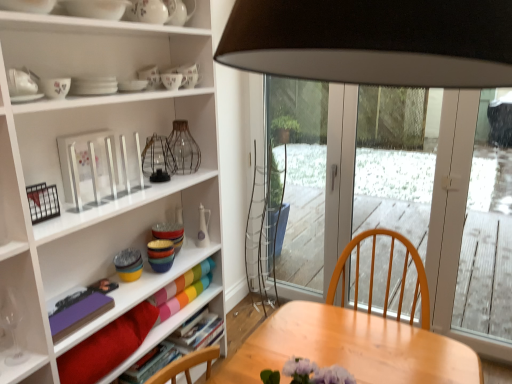
Question: Is white ceramic bowl at upper left, marked as the third tableware in a top-to-bottom arrangement, to the left of transparent glass wine glass at lower left from the viewer's perspective?

Choices:
 (A) yes
 (B) no

Answer: (B)

Question: Is white ceramic bowl at upper left, which is the 10th tableware from bottom to top, located outside transparent glass wine glass at lower left?

Choices:
 (A) yes
 (B) no

Answer: (A)

Question: Is white ceramic bowl at upper left, marked as the third tableware in a top-to-bottom arrangement, smaller than transparent glass wine glass at lower left?

Choices:
 (A) yes
 (B) no

Answer: (B)

Question: Does white ceramic bowl at upper left, which is the 10th tableware from bottom to top, have a larger size compared to transparent glass wine glass at lower left?

Choices:
 (A) no
 (B) yes

Answer: (B)

Question: Is white ceramic bowl at upper left, which is the 10th tableware from bottom to top, turned away from transparent glass wine glass at lower left?

Choices:
 (A) no
 (B) yes

Answer: (A)

Question: From the image's perspective, does white ceramic bowl at upper left, marked as the third tableware in a top-to-bottom arrangement, appear higher than transparent glass wine glass at lower left?

Choices:
 (A) yes
 (B) no

Answer: (A)

Question: Considering the relative sizes of white ceramic vase at center, placed as the third tableware when sorted from bottom to top, and purple matte book at lower left, acting as the first book starting from the front, in the image provided, is white ceramic vase at center, placed as the third tableware when sorted from bottom to top, smaller than purple matte book at lower left, acting as the first book starting from the front,?

Choices:
 (A) no
 (B) yes

Answer: (A)

Question: From the image's perspective, is white ceramic vase at center, placed as the third tableware when sorted from bottom to top, located beneath purple matte book at lower left, the 4th book when ordered from back to front?

Choices:
 (A) no
 (B) yes

Answer: (A)

Question: Is white ceramic vase at center, placed as the third tableware when sorted from bottom to top, taller than purple matte book at lower left, the 4th book when ordered from back to front?

Choices:
 (A) no
 (B) yes

Answer: (B)

Question: Can you confirm if white ceramic vase at center, the 10th tableware in the top-to-bottom sequence, is positioned to the right of purple matte book at lower left, the 4th book when ordered from back to front?

Choices:
 (A) no
 (B) yes

Answer: (B)

Question: Is purple matte book at lower left, the 4th book when ordered from back to front, at the back of white ceramic vase at center, placed as the third tableware when sorted from bottom to top?

Choices:
 (A) no
 (B) yes

Answer: (A)

Question: Can you confirm if white ceramic vase at center, the 10th tableware in the top-to-bottom sequence, is shorter than purple matte book at lower left, the 4th book when ordered from back to front?

Choices:
 (A) no
 (B) yes

Answer: (A)

Question: Can you confirm if white ceramic vase at center, placed as the third tableware when sorted from bottom to top, is thinner than velvet red cushion at lower left?

Choices:
 (A) yes
 (B) no

Answer: (A)